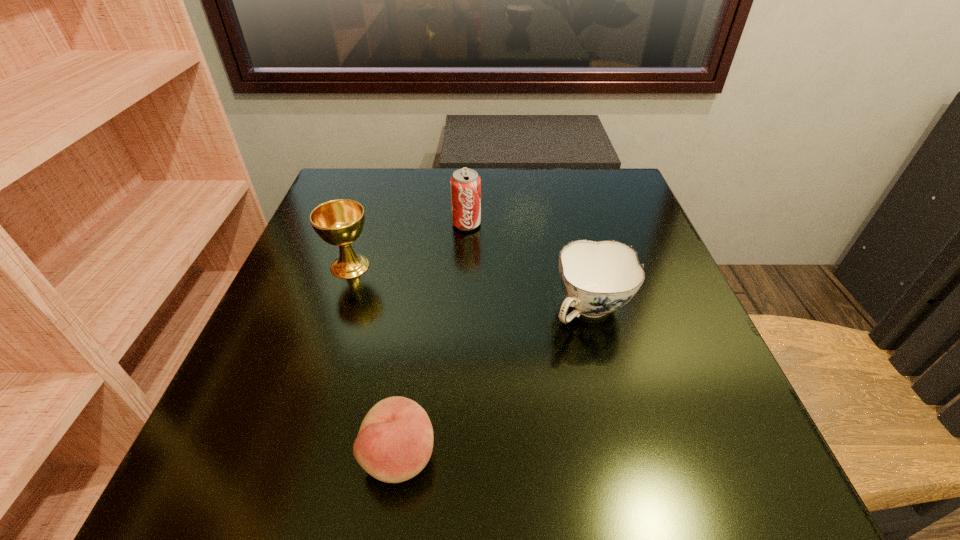
Where is `object that is at the left edge`? The width and height of the screenshot is (960, 540). object that is at the left edge is located at coordinates (339, 222).

Find the location of a particular element. This screenshot has height=540, width=960. object that is at the right edge is located at coordinates (597, 278).

I want to click on vacant area at the far edge, so click(x=495, y=187).

Identify the location of vacant point at the near edge. This screenshot has width=960, height=540. (305, 499).

The width and height of the screenshot is (960, 540). I want to click on vacant space at the left edge of the desktop, so click(x=300, y=434).

Locate an element on the screen. This screenshot has height=540, width=960. free space at the right edge of the desktop is located at coordinates (638, 229).

I want to click on vacant position at the far left corner of the desktop, so click(x=392, y=192).

The height and width of the screenshot is (540, 960). Identify the location of free space at the near left corner of the desktop. (256, 463).

In the image, there is a desktop. Where is `free space at the far right corner`? This screenshot has height=540, width=960. free space at the far right corner is located at coordinates (612, 208).

The height and width of the screenshot is (540, 960). Find the location of `vacant area that lies between the peach and the leftmost object`. vacant area that lies between the peach and the leftmost object is located at coordinates (374, 361).